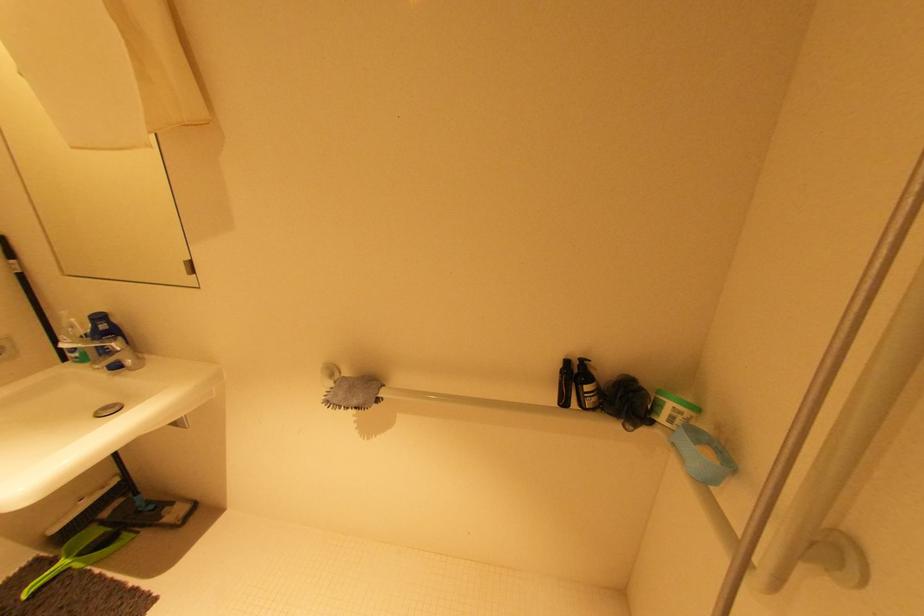
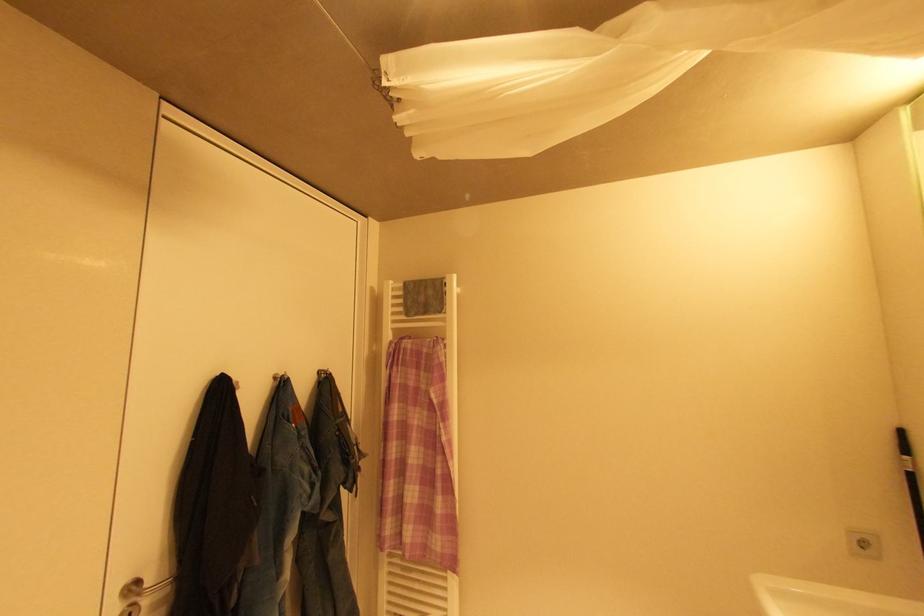
Question: The camera is either moving clockwise (left) or counter-clockwise (right) around the object. The first image is from the beginning of the video and the second image is from the end. Is the camera moving left or right when shooting the video?

Choices:
 (A) Left
 (B) Right

Answer: (B)